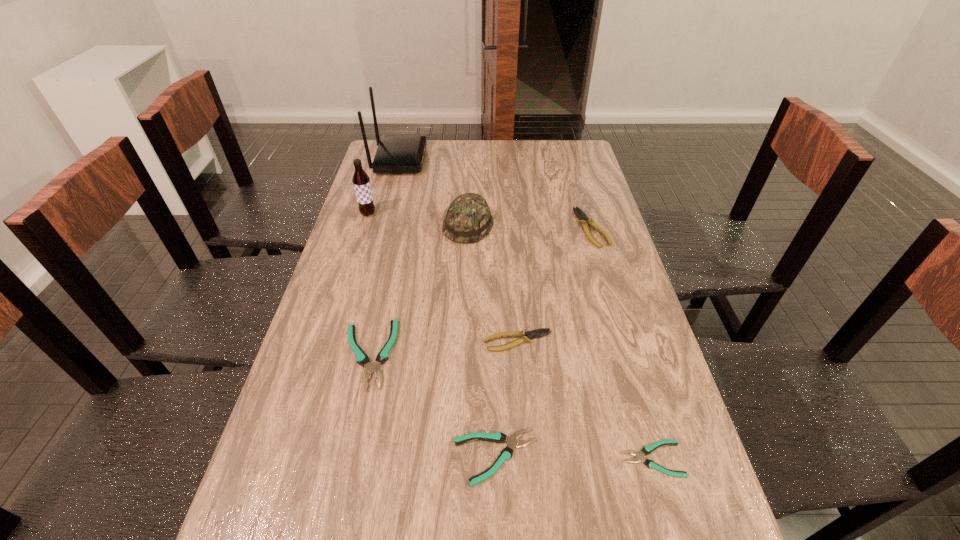
Image resolution: width=960 pixels, height=540 pixels. I want to click on blank space at the right edge, so click(620, 293).

At what (x,y) coordinates should I click in order to perform the action: click on free location at the far right corner of the desktop. Please return your answer as a coordinate pair (x, y). The width and height of the screenshot is (960, 540). Looking at the image, I should click on (566, 151).

Where is `empty space between the leftmost pliers and the left yellow pliers`? empty space between the leftmost pliers and the left yellow pliers is located at coordinates click(443, 348).

Image resolution: width=960 pixels, height=540 pixels. I want to click on vacant area that lies between the biggest teal pliers and the left yellow pliers, so click(443, 348).

The width and height of the screenshot is (960, 540). What are the coordinates of `unoccupied area between the brown root beer and the biggest teal pliers` in the screenshot? It's located at (368, 284).

The height and width of the screenshot is (540, 960). Find the location of `vacant area between the smaller yellow pliers and the farthest object`. vacant area between the smaller yellow pliers and the farthest object is located at coordinates (459, 251).

You are a GUI agent. You are given a task and a screenshot of the screen. Output one action in this format:
    pyautogui.click(x=<x>, y=<y>)
    Task: Click on the free spot between the farthest pliers and the router
    
    Given the screenshot: What is the action you would take?
    pyautogui.click(x=495, y=194)

Image resolution: width=960 pixels, height=540 pixels. Identify the location of vacant area that lies between the tallest object and the leftmost pliers. (384, 257).

The height and width of the screenshot is (540, 960). In order to click on unoccupied position between the headwear and the smaller yellow pliers in this screenshot , I will do `click(493, 284)`.

The image size is (960, 540). I want to click on free point between the leftmost teal pliers and the left yellow pliers, so click(x=443, y=348).